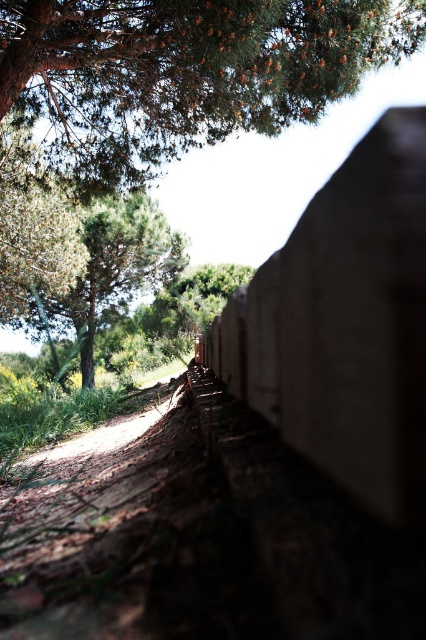
Who is positioned more to the left, green textured pine tree at upper left or green leafy tree at upper left?

From the viewer's perspective, green leafy tree at upper left appears more on the left side.

The width and height of the screenshot is (426, 640). Find the location of `green textured pine tree at upper left`. green textured pine tree at upper left is located at coordinates (184, 72).

Where is `green textured pine tree at upper left`? This screenshot has height=640, width=426. green textured pine tree at upper left is located at coordinates (184, 72).

Locate an element on the screen. green textured pine tree at upper left is located at coordinates (184, 72).